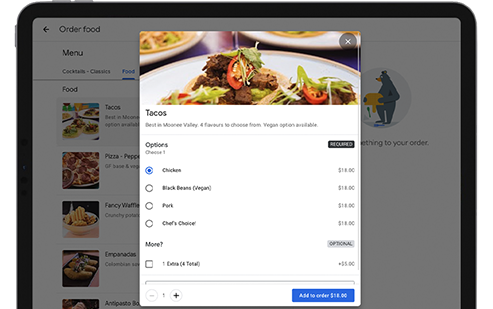
The width and height of the screenshot is (493, 309). I want to click on plates, so click(171, 74), click(316, 45), click(157, 57).